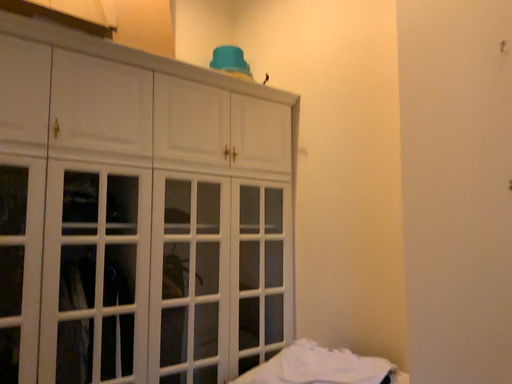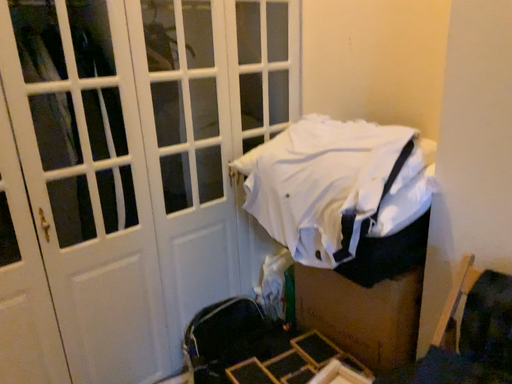
Question: How did the camera likely rotate when shooting the video?

Choices:
 (A) rotated downward
 (B) rotated upward

Answer: (A)